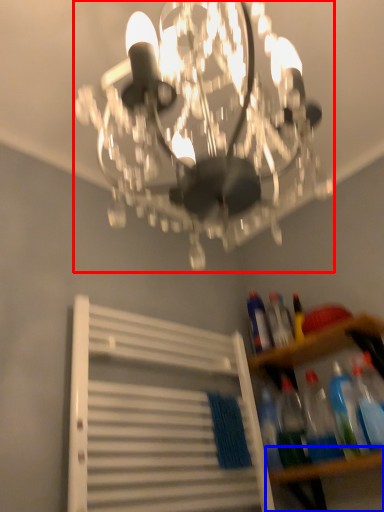
Question: Which object appears farthest to the camera in this image, lamp (highlighted by a red box) or table (highlighted by a blue box)?

Choices:
 (A) lamp
 (B) table

Answer: (B)